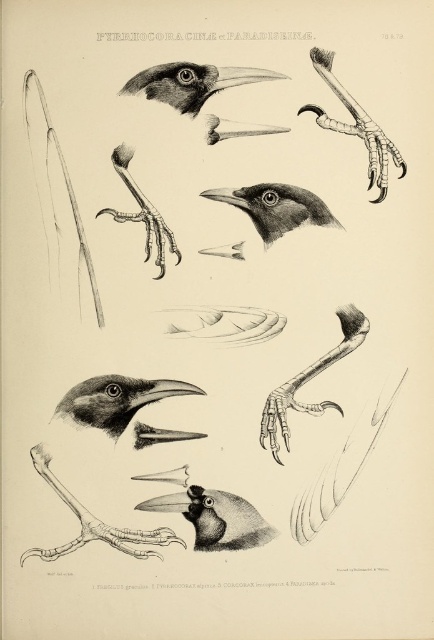
Looking at the illustration of bird anatomy, you notice the matte black beak at center and the smooth black crow at center. Which of these two features is positioned closer to the viewer?

The matte black beak at center is positioned closer to the viewer as it is in front of the smooth black crow at center.

You are an ornithologist examining the illustration. You need to determine the spatial relationship between the gray pencil sketch bird head at upper center and the black glossy beak at center. Which object appears closer to the viewer?

The gray pencil sketch bird head at upper center is closer to the viewer than the black glossy beak at center.